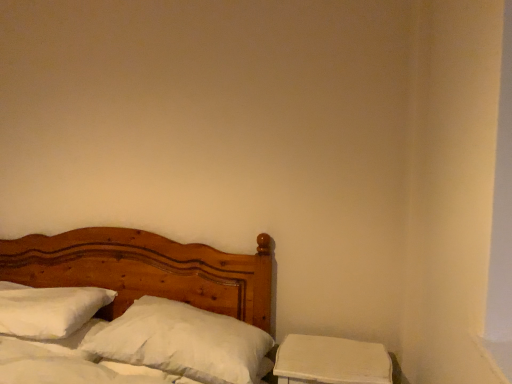
Question: Is white matte nightstand at lower right at the left side of white soft pillow at center, the 2th pillow from the left?

Choices:
 (A) yes
 (B) no

Answer: (B)

Question: Would you say white soft pillow at center, which is the 1th pillow in right-to-left order, is part of white matte nightstand at lower right's contents?

Choices:
 (A) no
 (B) yes

Answer: (A)

Question: Is white matte nightstand at lower right smaller than white soft pillow at center, the 2th pillow from the left?

Choices:
 (A) yes
 (B) no

Answer: (A)

Question: Is white soft pillow at center, the 2th pillow from the left, at the back of white matte nightstand at lower right?

Choices:
 (A) no
 (B) yes

Answer: (A)

Question: From the image's perspective, is white matte nightstand at lower right below white soft pillow at center, the 2th pillow from the left?

Choices:
 (A) no
 (B) yes

Answer: (B)

Question: Looking at the image, does white soft pillow at center, the 2th pillow from the left, seem bigger or smaller compared to white matte nightstand at lower right?

Choices:
 (A) small
 (B) big

Answer: (B)

Question: Would you say white soft pillow at center, which is the 1th pillow in right-to-left order, is to the left or to the right of white matte nightstand at lower right in the picture?

Choices:
 (A) right
 (B) left

Answer: (B)

Question: Looking at their shapes, would you say white soft pillow at center, the 2th pillow from the left, is wider or thinner than white matte nightstand at lower right?

Choices:
 (A) wide
 (B) thin

Answer: (A)

Question: Relative to white matte nightstand at lower right, is white soft pillow at center, which is the 1th pillow in right-to-left order, in front or behind?

Choices:
 (A) front
 (B) behind

Answer: (B)

Question: Is wooden bed at left bigger or smaller than white matte nightstand at lower right?

Choices:
 (A) small
 (B) big

Answer: (B)

Question: Is wooden bed at left inside or outside of white matte nightstand at lower right?

Choices:
 (A) outside
 (B) inside

Answer: (A)

Question: From a real-world perspective, is wooden bed at left above or below white matte nightstand at lower right?

Choices:
 (A) above
 (B) below

Answer: (A)

Question: Is wooden bed at left wider or thinner than white matte nightstand at lower right?

Choices:
 (A) thin
 (B) wide

Answer: (B)

Question: Is point (143, 332) positioned closer to the camera than point (10, 296)?

Choices:
 (A) farther
 (B) closer

Answer: (B)

Question: Is white soft pillow at center, which is the 1th pillow in right-to-left order, bigger or smaller than white soft pillow at left, the second pillow in the right-to-left sequence?

Choices:
 (A) big
 (B) small

Answer: (A)